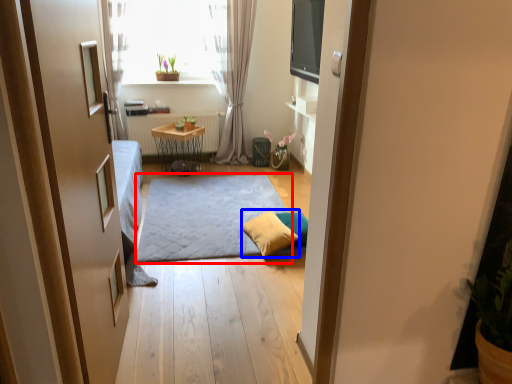
Question: Which object is further to the camera taking this photo, doormat (highlighted by a red box) or pillow (highlighted by a blue box)?

Choices:
 (A) doormat
 (B) pillow

Answer: (B)